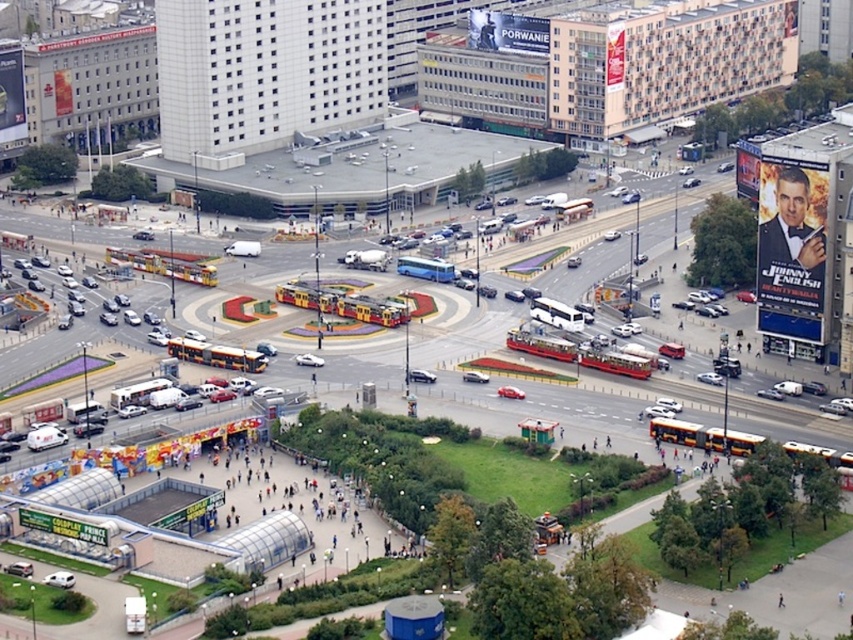
Question: Can you confirm if metallic silver billboard at upper right is wider than metallic silver billboard at upper left?

Choices:
 (A) no
 (B) yes

Answer: (B)

Question: Which point is closer to the camera taking this photo?

Choices:
 (A) (524, 28)
 (B) (608, 26)
 (C) (22, 100)

Answer: (B)

Question: Which point is closer to the camera?

Choices:
 (A) metallic silver billboard at upper right
 (B) metallic silver billboard at upper left

Answer: (A)

Question: Considering the relative positions of metallic silver billboard at upper right and metallic silver billboard at upper center in the image provided, where is metallic silver billboard at upper right located with respect to metallic silver billboard at upper center?

Choices:
 (A) left
 (B) right

Answer: (B)

Question: Which point appears farthest from the camera in this image?

Choices:
 (A) (476, 16)
 (B) (0, 81)

Answer: (A)

Question: Observing the image, what is the correct spatial positioning of metallic silver billboard at upper right in reference to metallic silver billboard at upper left?

Choices:
 (A) below
 (B) above

Answer: (A)